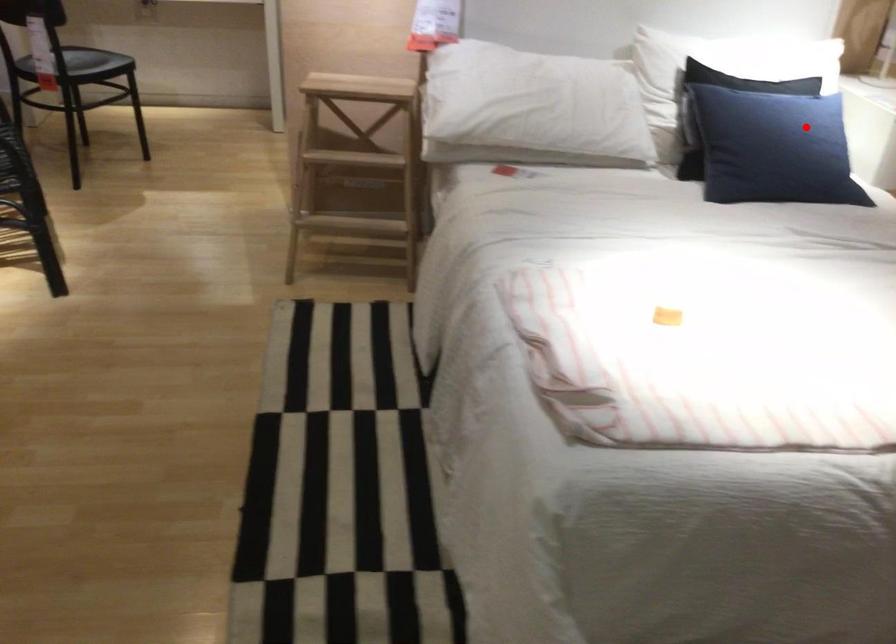
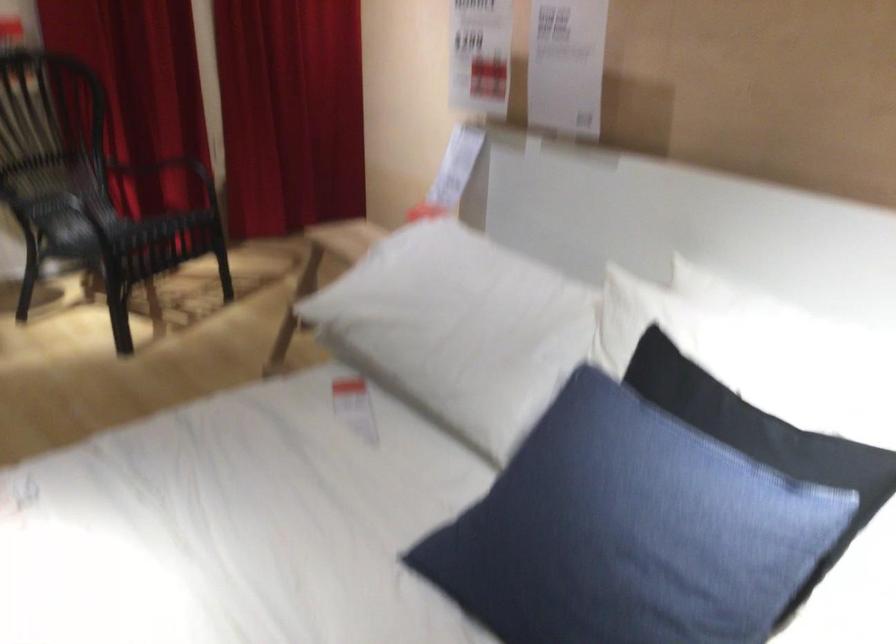
Question: I am providing you with two images of the same scene from different viewpoints. In image1, a red point is highlighted. Considering the same 3D point in image2, which of the following is correct?

Choices:
 (A) It is closer
 (B) It is farther

Answer: (A)